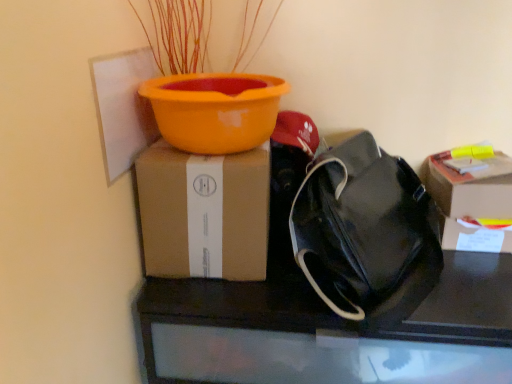
Identify the location of black leather bag at center. Image resolution: width=512 pixels, height=384 pixels. (315, 323).

Describe the element at coordinates (204, 213) in the screenshot. I see `brown cardboard box at upper left, positioned as the second box in right-to-left order` at that location.

Where is `black leather bag at center`? The width and height of the screenshot is (512, 384). black leather bag at center is located at coordinates tap(315, 323).

Are black leather handbag at right and black leather bag at center located far from each other?

No.

From the image's perspective, is black leather handbag at right located above black leather bag at center?

Yes, from the image's perspective, black leather handbag at right is over black leather bag at center.

Between black leather handbag at right and black leather bag at center, which one has less height?

With less height is black leather handbag at right.

Is brown cardboard box at upper left, which is counted as the 1th box, starting from the left, in front of or behind black leather handbag at right in the image?

brown cardboard box at upper left, which is counted as the 1th box, starting from the left, is behind black leather handbag at right.

Is brown cardboard box at upper left, which is counted as the 1th box, starting from the left, to the left or to the right of black leather handbag at right in the image?

Based on their positions, brown cardboard box at upper left, which is counted as the 1th box, starting from the left, is located to the left of black leather handbag at right.

Identify the location of the 1st box directly beneath the black leather handbag at right (from a real-world perspective). The image size is (512, 384). (204, 213).

Considering the sizes of brown cardboard box at upper left, which is counted as the 1th box, starting from the left, and black leather handbag at right in the image, is brown cardboard box at upper left, which is counted as the 1th box, starting from the left, bigger or smaller than black leather handbag at right?

Clearly, brown cardboard box at upper left, which is counted as the 1th box, starting from the left, is smaller in size than black leather handbag at right.

You are a GUI agent. You are given a task and a screenshot of the screen. Output one action in this format:
    pyautogui.click(x=<x>, y=<y>)
    Task: Click on the box above the cardboard box at right, arranged as the second box when viewed from the left (from a real-world perspective)
    
    Given the screenshot: What is the action you would take?
    pyautogui.click(x=204, y=213)

Is cardboard box at right, arranged as the second box when viewed from the left, to the right of brown cardboard box at upper left, which is counted as the 1th box, starting from the left, from the viewer's perspective?

Correct, you'll find cardboard box at right, arranged as the second box when viewed from the left, to the right of brown cardboard box at upper left, which is counted as the 1th box, starting from the left.

Considering the points (495, 175) and (148, 211), which point is behind, point (495, 175) or point (148, 211)?

The point (495, 175) is farther.

In terms of width, does black leather handbag at right look wider or thinner when compared to brown cardboard box at upper left, positioned as the second box in right-to-left order?

In the image, black leather handbag at right appears to be more narrow than brown cardboard box at upper left, positioned as the second box in right-to-left order.

Are black leather handbag at right and brown cardboard box at upper left, positioned as the second box in right-to-left order, beside each other?

No, black leather handbag at right is not with brown cardboard box at upper left, positioned as the second box in right-to-left order.

Is black leather handbag at right positioned with its back to brown cardboard box at upper left, which is counted as the 1th box, starting from the left?

Yes, brown cardboard box at upper left, which is counted as the 1th box, starting from the left, is at the back of black leather handbag at right.

Is black leather handbag at right bigger than brown cardboard box at upper left, which is counted as the 1th box, starting from the left?

Yes, black leather handbag at right is bigger than brown cardboard box at upper left, which is counted as the 1th box, starting from the left.

Would you say black leather handbag at right is to the left or to the right of cardboard box at right, which appears as the 1th box when viewed from the right, in the picture?

From the image, it's evident that black leather handbag at right is to the left of cardboard box at right, which appears as the 1th box when viewed from the right.

From a real-world perspective, between black leather handbag at right and cardboard box at right, arranged as the second box when viewed from the left, who is vertically lower?

cardboard box at right, arranged as the second box when viewed from the left, is physically lower.

Is black leather handbag at right situated inside cardboard box at right, arranged as the second box when viewed from the left, or outside?

black leather handbag at right is not enclosed by cardboard box at right, arranged as the second box when viewed from the left.

Is black leather bag at center inside the boundaries of brown cardboard box at upper left, which is counted as the 1th box, starting from the left, or outside?

black leather bag at center lies outside brown cardboard box at upper left, which is counted as the 1th box, starting from the left.

Can you confirm if black leather bag at center is shorter than brown cardboard box at upper left, which is counted as the 1th box, starting from the left?

No, black leather bag at center is not shorter than brown cardboard box at upper left, which is counted as the 1th box, starting from the left.

The width and height of the screenshot is (512, 384). Identify the location of the 2nd box located above the black leather bag at center (from a real-world perspective). [x=204, y=213].

Is cardboard box at right, which appears as the 1th box when viewed from the right, to the right of black leather bag at center from the viewer's perspective?

Correct, you'll find cardboard box at right, which appears as the 1th box when viewed from the right, to the right of black leather bag at center.

Considering the relative sizes of cardboard box at right, which appears as the 1th box when viewed from the right, and black leather bag at center in the image provided, is cardboard box at right, which appears as the 1th box when viewed from the right, wider than black leather bag at center?

Incorrect, the width of cardboard box at right, which appears as the 1th box when viewed from the right, does not surpass that of black leather bag at center.

Can we say cardboard box at right, arranged as the second box when viewed from the left, lies outside black leather bag at center?

Yes, cardboard box at right, arranged as the second box when viewed from the left, is outside of black leather bag at center.

At what (x,y) coordinates should I click in order to perform the action: click on handbag on the left side of black leather bag at center. Please return your answer as a coordinate pair (x, y). Looking at the image, I should click on (360, 225).

At what (x,y) coordinates should I click in order to perform the action: click on handbag lying on the right of brown cardboard box at upper left, positioned as the second box in right-to-left order. Please return your answer as a coordinate pair (x, y). Looking at the image, I should click on (360, 225).

From the image, which object appears to be farther from brown cardboard box at upper left, positioned as the second box in right-to-left order, black leather handbag at right or black leather bag at center?

black leather handbag at right lies further to brown cardboard box at upper left, positioned as the second box in right-to-left order, than the other object.

Which object lies further to the anchor point black leather bag at center, black leather handbag at right or brown cardboard box at upper left, positioned as the second box in right-to-left order?

Based on the image, brown cardboard box at upper left, positioned as the second box in right-to-left order, appears to be further to black leather bag at center.

Consider the image. From the image, which object appears to be nearer to brown cardboard box at upper left, positioned as the second box in right-to-left order, black leather bag at center or black leather handbag at right?

The object closer to brown cardboard box at upper left, positioned as the second box in right-to-left order, is black leather bag at center.

Which object lies further to the anchor point black leather handbag at right, black leather bag at center or brown cardboard box at upper left, which is counted as the 1th box, starting from the left?

brown cardboard box at upper left, which is counted as the 1th box, starting from the left, is further to black leather handbag at right.

From the image, which object appears to be farther from black leather bag at center, black leather handbag at right or cardboard box at right, arranged as the second box when viewed from the left?

Based on the image, cardboard box at right, arranged as the second box when viewed from the left, appears to be further to black leather bag at center.

Consider the image. Based on their spatial positions, is cardboard box at right, arranged as the second box when viewed from the left, or brown cardboard box at upper left, positioned as the second box in right-to-left order, further from black leather bag at center?

Based on the image, cardboard box at right, arranged as the second box when viewed from the left, appears to be further to black leather bag at center.

In the scene shown: When comparing their distances from cardboard box at right, arranged as the second box when viewed from the left, does black leather handbag at right or brown cardboard box at upper left, positioned as the second box in right-to-left order, seem further?

brown cardboard box at upper left, positioned as the second box in right-to-left order, lies further to cardboard box at right, arranged as the second box when viewed from the left, than the other object.

Based on their spatial positions, is cardboard box at right, arranged as the second box when viewed from the left, or brown cardboard box at upper left, which is counted as the 1th box, starting from the left, closer to black leather handbag at right?

Among the two, cardboard box at right, arranged as the second box when viewed from the left, is located nearer to black leather handbag at right.

Locate an element on the screen. handbag between brown cardboard box at upper left, positioned as the second box in right-to-left order, and black leather bag at center from top to bottom is located at coordinates (360, 225).

Where is `handbag between brown cardboard box at upper left, which is counted as the 1th box, starting from the left, and cardboard box at right, arranged as the second box when viewed from the left`? This screenshot has height=384, width=512. handbag between brown cardboard box at upper left, which is counted as the 1th box, starting from the left, and cardboard box at right, arranged as the second box when viewed from the left is located at coordinates (360, 225).

Identify the location of box between black leather handbag at right and black leather bag at center vertically. (471, 202).

Locate an element on the screen. The width and height of the screenshot is (512, 384). desk between brown cardboard box at upper left, which is counted as the 1th box, starting from the left, and cardboard box at right, which appears as the 1th box when viewed from the right, in the horizontal direction is located at coordinates (315, 323).